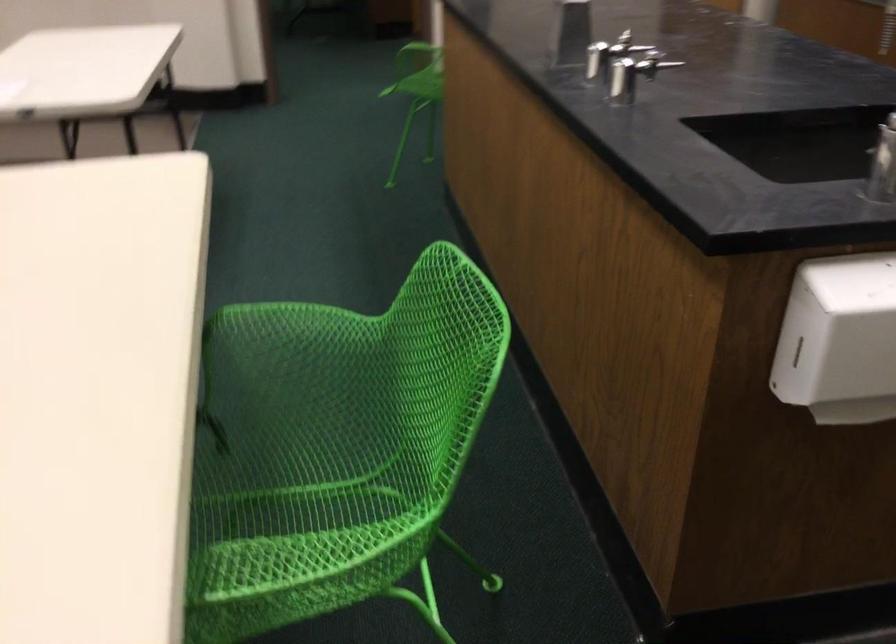
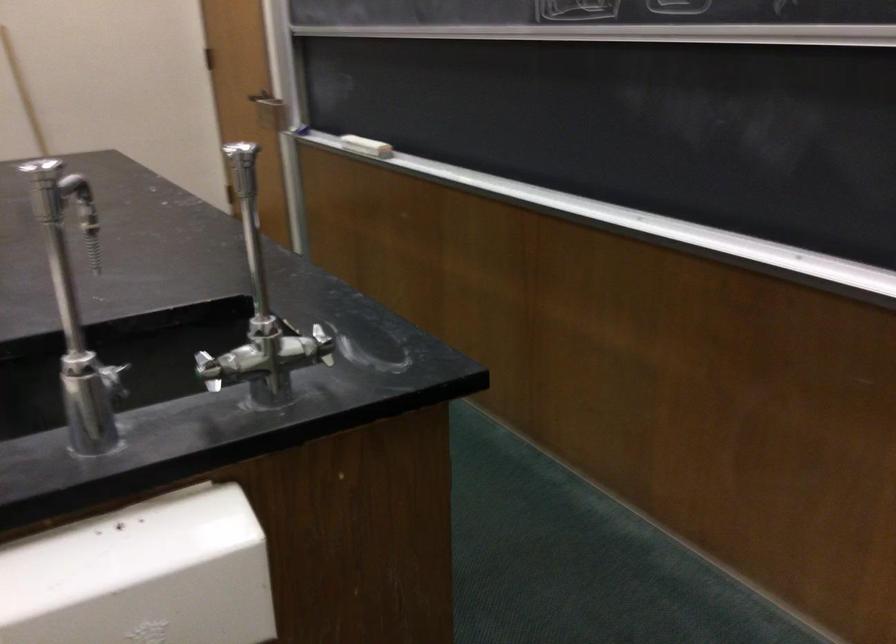
Question: The camera is either moving clockwise (left) or counter-clockwise (right) around the object. The first image is from the beginning of the video and the second image is from the end. Is the camera moving left or right when shooting the video?

Choices:
 (A) Left
 (B) Right

Answer: (A)